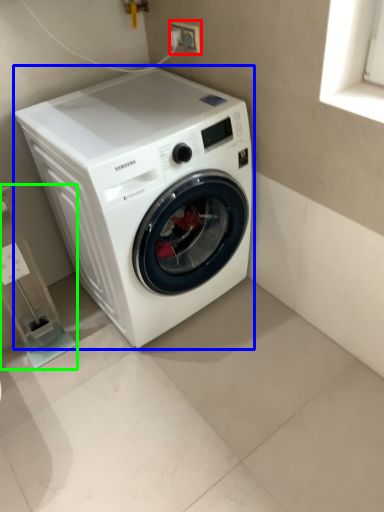
Question: Estimate the real-world distances between objects in this image. Which object is closer to electric outlet (highlighted by a red box), washing machine (highlighted by a blue box) or shelf (highlighted by a green box)?

Choices:
 (A) washing machine
 (B) shelf

Answer: (A)